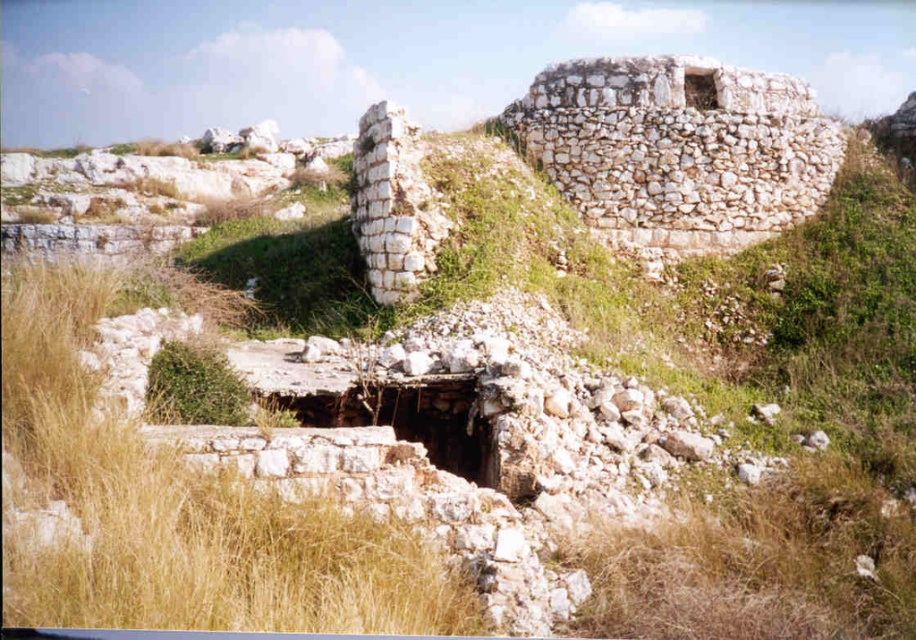
You are a hiker who has reached the top of a hill and is looking at the ancient stone structure. You notice dry grass at center and white stone wall at center. Which object is closer to the ground?

The dry grass at center is below the white stone wall at center, so it is closer to the ground.

Consider the image. You are an archaeologist examining the ancient stone structure. You notice dry grass at center and a white stone wall at center. Which object is closer to your current position?

The dry grass at center is closer to your current position because it is in front of the white stone wall at center.

You are standing in front of the ancient stone structure and notice a specific point marked at coordinates point (181,512). What is located at that point?

The point (181,512) indicates dry grass at center.